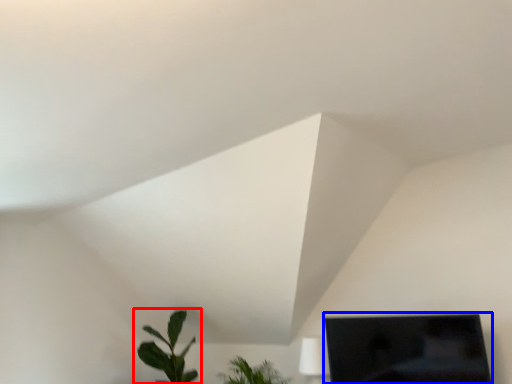
Question: Which object is further to the camera taking this photo, houseplant (highlighted by a red box) or computer monitor (highlighted by a blue box)?

Choices:
 (A) houseplant
 (B) computer monitor

Answer: (A)